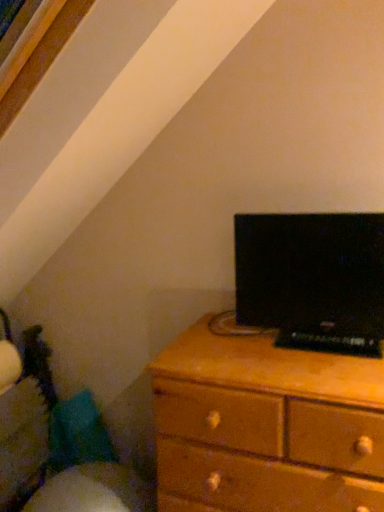
At what (x,y) coordinates should I click in order to perform the action: click on free space on the front side of black glossy monitor at upper right. Please return your answer as a coordinate pair (x, y). Looking at the image, I should click on (315, 369).